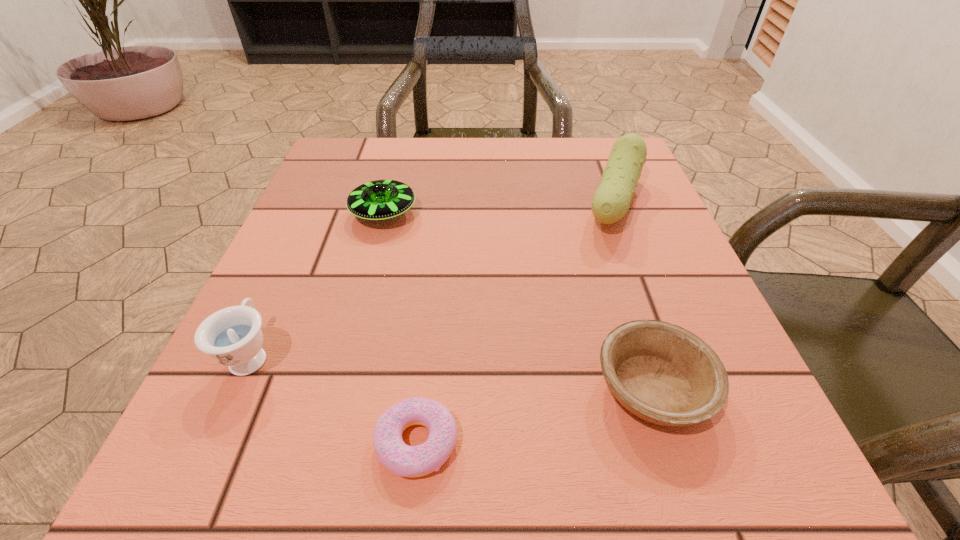
You are a GUI agent. You are given a task and a screenshot of the screen. Output one action in this format:
    pyautogui.click(x=<x>, y=<y>)
    Task: Click on the vacant space that satisfies the following two spatial constraints: 1. on the side of the saucer with the handle; 2. on the left side of the teacup
    
    Given the screenshot: What is the action you would take?
    pyautogui.click(x=315, y=213)

Where is `free location that satisfies the following two spatial constraints: 1. on the side of the saucer with the handle; 2. on the right side of the leftmost object`? The image size is (960, 540). free location that satisfies the following two spatial constraints: 1. on the side of the saucer with the handle; 2. on the right side of the leftmost object is located at coordinates (315, 213).

The width and height of the screenshot is (960, 540). Find the location of `vacant area that satisfies the following two spatial constraints: 1. on the side of the teacup with the handle; 2. on the right side of the saucer`. vacant area that satisfies the following two spatial constraints: 1. on the side of the teacup with the handle; 2. on the right side of the saucer is located at coordinates (315, 213).

The height and width of the screenshot is (540, 960). Identify the location of vacant space that satisfies the following two spatial constraints: 1. on the back side of the tallest object; 2. on the right side of the shortest object. (443, 202).